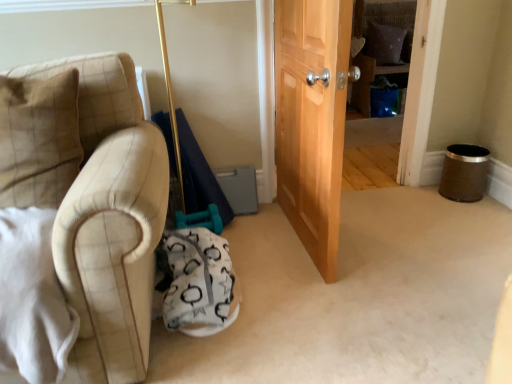
What do you see at coordinates (38, 139) in the screenshot? The width and height of the screenshot is (512, 384). I see `beige plaid pillow at left, placed as the second pillow when sorted from top to bottom` at bounding box center [38, 139].

What do you see at coordinates (384, 43) in the screenshot? I see `brown fabric pillow at upper center, the first pillow positioned from the top` at bounding box center [384, 43].

Locate an element on the screen. The width and height of the screenshot is (512, 384). white fabric swivel chair at lower center is located at coordinates (199, 282).

From the image's perspective, is beige plaid pillow at left, which is counted as the 1th pillow, starting from the bottom, on brown fabric pillow at upper center, the first pillow positioned from the top?

No.

How distant is beige plaid pillow at left, arranged as the second pillow when viewed from the right, from brown fabric pillow at upper center, the second pillow from the bottom?

A distance of 3.30 meters exists between beige plaid pillow at left, arranged as the second pillow when viewed from the right, and brown fabric pillow at upper center, the second pillow from the bottom.

Find the location of a particular element. The width and height of the screenshot is (512, 384). pillow on the left side of brown fabric pillow at upper center, which ranks as the second pillow in left-to-right order is located at coordinates (38, 139).

From a real-world perspective, is beige plaid pillow at left, the first pillow viewed from the front, physically below brown fabric pillow at upper center, placed as the first pillow when sorted from right to left?

Actually, beige plaid pillow at left, the first pillow viewed from the front, is physically above brown fabric pillow at upper center, placed as the first pillow when sorted from right to left, in the real world.

Find the location of a particular element. This screenshot has height=384, width=512. swivel chair in front of the brown fabric pillow at upper center, which is counted as the 2th pillow, starting from the front is located at coordinates (199, 282).

Is there a large distance between white fabric swivel chair at lower center and brown fabric pillow at upper center, placed as the first pillow when sorted from right to left?

white fabric swivel chair at lower center is far away from brown fabric pillow at upper center, placed as the first pillow when sorted from right to left.

Which of these two, white fabric swivel chair at lower center or brown fabric pillow at upper center, the first pillow positioned from the top, stands shorter?

Standing shorter between the two is white fabric swivel chair at lower center.

Between white fabric swivel chair at lower center and brown fabric pillow at upper center, which ranks as the second pillow in left-to-right order, which one appears on the right side from the viewer's perspective?

brown fabric pillow at upper center, which ranks as the second pillow in left-to-right order.

Is white fabric swivel chair at lower center oriented towards beige plaid pillow at left, placed as the second pillow when sorted from top to bottom?

No, white fabric swivel chair at lower center is not aimed at beige plaid pillow at left, placed as the second pillow when sorted from top to bottom.

The width and height of the screenshot is (512, 384). I want to click on pillow on the left of white fabric swivel chair at lower center, so click(x=38, y=139).

Between white fabric swivel chair at lower center and beige plaid pillow at left, which is counted as the 1th pillow, starting from the bottom, which one appears on the left side from the viewer's perspective?

beige plaid pillow at left, which is counted as the 1th pillow, starting from the bottom.

From a real-world perspective, relative to beige plaid pillow at left, arranged as the second pillow when viewed from the right, is white fabric swivel chair at lower center vertically above or below?

Clearly, from a real-world perspective, white fabric swivel chair at lower center is below beige plaid pillow at left, arranged as the second pillow when viewed from the right.

How distant is beige plaid pillow at left, arranged as the second pillow when viewed from the right, from white fabric swivel chair at lower center?

beige plaid pillow at left, arranged as the second pillow when viewed from the right, is 23.27 inches away from white fabric swivel chair at lower center.

At what (x,y) coordinates should I click in order to perform the action: click on swivel chair behind the beige plaid pillow at left, placed as the second pillow when sorted from top to bottom. Please return your answer as a coordinate pair (x, y). The height and width of the screenshot is (384, 512). Looking at the image, I should click on (199, 282).

Is white fabric swivel chair at lower center at the back of beige plaid pillow at left, which is counted as the 1th pillow, starting from the bottom?

No, beige plaid pillow at left, which is counted as the 1th pillow, starting from the bottom, is not facing away from white fabric swivel chair at lower center.

Considering the relative positions of beige plaid pillow at left, placed as the second pillow when sorted from top to bottom, and white fabric swivel chair at lower center in the image provided, is beige plaid pillow at left, placed as the second pillow when sorted from top to bottom, in front of white fabric swivel chair at lower center?

Yes, it is in front of white fabric swivel chair at lower center.

From the image's perspective, does brown fabric pillow at upper center, which is counted as the first pillow, starting from the back, appear higher than beige plaid pillow at left, which is counted as the 1th pillow, starting from the bottom?

Indeed, from the image's perspective, brown fabric pillow at upper center, which is counted as the first pillow, starting from the back, is shown above beige plaid pillow at left, which is counted as the 1th pillow, starting from the bottom.

At what (x,y) coordinates should I click in order to perform the action: click on pillow below the brown fabric pillow at upper center, placed as the first pillow when sorted from right to left (from the image's perspective). Please return your answer as a coordinate pair (x, y). Looking at the image, I should click on (38, 139).

Are brown fabric pillow at upper center, which is counted as the 2th pillow, starting from the front, and beige plaid pillow at left, the 2th pillow when ordered from back to front, beside each other?

brown fabric pillow at upper center, which is counted as the 2th pillow, starting from the front, and beige plaid pillow at left, the 2th pillow when ordered from back to front, are clearly separated.

From a real-world perspective, is brown fabric pillow at upper center, which is counted as the first pillow, starting from the back, below beige plaid pillow at left, arranged as the second pillow when viewed from the right?

Yes.

In the scene shown: From the image's perspective, which is above, brown fabric pillow at upper center, the first pillow positioned from the top, or white fabric swivel chair at lower center?

brown fabric pillow at upper center, the first pillow positioned from the top, from the image's perspective.

Who is smaller, brown fabric pillow at upper center, the second pillow from the bottom, or white fabric swivel chair at lower center?

brown fabric pillow at upper center, the second pillow from the bottom, is smaller.

Is brown fabric pillow at upper center, the first pillow positioned from the top, aimed at white fabric swivel chair at lower center?

No, brown fabric pillow at upper center, the first pillow positioned from the top, is not turned towards white fabric swivel chair at lower center.

In the image, there is a brown fabric pillow at upper center, which is counted as the first pillow, starting from the back. Where is `pillow below it (from the image's perspective)`? The height and width of the screenshot is (384, 512). pillow below it (from the image's perspective) is located at coordinates [38, 139].

Find the location of a particular element. The image size is (512, 384). the 1st pillow above the white fabric swivel chair at lower center (from a real-world perspective) is located at coordinates (384, 43).

When comparing their distances from white fabric swivel chair at lower center, does beige plaid pillow at left, which is counted as the 1th pillow, starting from the bottom, or brown fabric pillow at upper center, the second pillow from the bottom, seem closer?

beige plaid pillow at left, which is counted as the 1th pillow, starting from the bottom.

Looking at the image, which one is located further to beige plaid pillow at left, the first pillow viewed from the front, white fabric swivel chair at lower center or brown fabric pillow at upper center, which is counted as the 2th pillow, starting from the front?

brown fabric pillow at upper center, which is counted as the 2th pillow, starting from the front.

When comparing their distances from white fabric swivel chair at lower center, does brown fabric pillow at upper center, placed as the first pillow when sorted from right to left, or beige plaid pillow at left, placed as the second pillow when sorted from top to bottom, seem closer?

beige plaid pillow at left, placed as the second pillow when sorted from top to bottom, lies closer to white fabric swivel chair at lower center than the other object.

Looking at the image, which one is located further to brown fabric pillow at upper center, the second pillow from the bottom, beige plaid pillow at left, the first pillow viewed from the front, or white fabric swivel chair at lower center?

beige plaid pillow at left, the first pillow viewed from the front, lies further to brown fabric pillow at upper center, the second pillow from the bottom, than the other object.

Based on their spatial positions, is white fabric swivel chair at lower center or beige plaid pillow at left, the 2th pillow when ordered from back to front, further from brown fabric pillow at upper center, the first pillow positioned from the top?

beige plaid pillow at left, the 2th pillow when ordered from back to front, is positioned further to the anchor brown fabric pillow at upper center, the first pillow positioned from the top.

Based on their spatial positions, is brown fabric pillow at upper center, which ranks as the second pillow in left-to-right order, or white fabric swivel chair at lower center closer to beige plaid pillow at left, the first pillow viewed from the front?

Based on the image, white fabric swivel chair at lower center appears to be nearer to beige plaid pillow at left, the first pillow viewed from the front.

You are a GUI agent. You are given a task and a screenshot of the screen. Output one action in this format:
    pyautogui.click(x=<x>, y=<y>)
    Task: Click on the swivel chair between beige plaid pillow at left, which is counted as the 1th pillow, starting from the bottom, and brown fabric pillow at upper center, which ranks as the second pillow in left-to-right order, from front to back
    
    Given the screenshot: What is the action you would take?
    pyautogui.click(x=199, y=282)